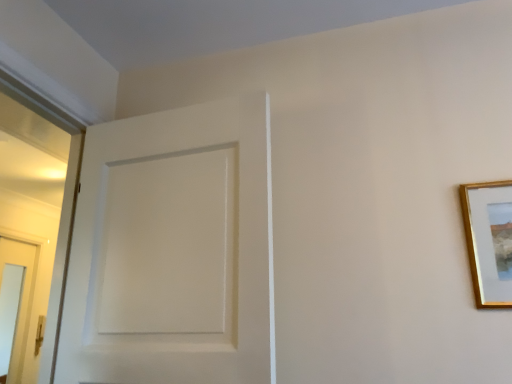
Question: Can you confirm if white matte door at center is thinner than gold wooden picture frame at upper right?

Choices:
 (A) no
 (B) yes

Answer: (A)

Question: Is white matte door at center turned away from gold wooden picture frame at upper right?

Choices:
 (A) no
 (B) yes

Answer: (A)

Question: Is white matte door at center smaller than gold wooden picture frame at upper right?

Choices:
 (A) yes
 (B) no

Answer: (B)

Question: From a real-world perspective, is white matte door at center physically below gold wooden picture frame at upper right?

Choices:
 (A) yes
 (B) no

Answer: (B)

Question: Is white matte door at center at the left side of gold wooden picture frame at upper right?

Choices:
 (A) yes
 (B) no

Answer: (A)

Question: Considering the relative sizes of white matte door at center and gold wooden picture frame at upper right in the image provided, is white matte door at center taller than gold wooden picture frame at upper right?

Choices:
 (A) no
 (B) yes

Answer: (B)

Question: Is the depth of gold wooden picture frame at upper right greater than that of white matte door at center?

Choices:
 (A) yes
 (B) no

Answer: (A)

Question: Would you say gold wooden picture frame at upper right is a long distance from white matte door at center?

Choices:
 (A) yes
 (B) no

Answer: (B)

Question: Does gold wooden picture frame at upper right touch white matte door at center?

Choices:
 (A) yes
 (B) no

Answer: (B)

Question: Is gold wooden picture frame at upper right positioned beyond the bounds of white matte door at center?

Choices:
 (A) no
 (B) yes

Answer: (B)

Question: From a real-world perspective, is gold wooden picture frame at upper right beneath white matte door at center?

Choices:
 (A) yes
 (B) no

Answer: (A)

Question: From the image's perspective, is gold wooden picture frame at upper right beneath white matte door at center?

Choices:
 (A) no
 (B) yes

Answer: (B)

Question: In the image, is white matte door at center on the left side or the right side of gold wooden picture frame at upper right?

Choices:
 (A) right
 (B) left

Answer: (B)